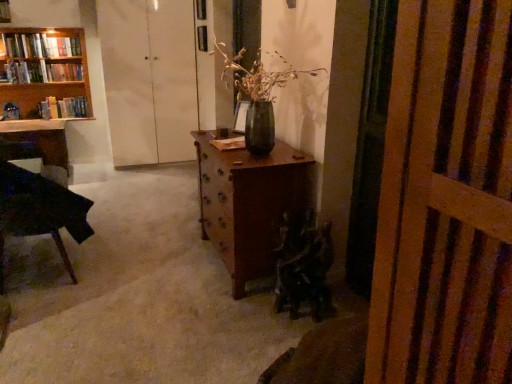
Question: Is matte black desk at left facing away from wooden bookshelf at upper left, arranged as the third book when viewed from the top?

Choices:
 (A) yes
 (B) no

Answer: (B)

Question: Is matte black desk at left not inside wooden bookshelf at upper left, arranged as the third book when viewed from the top?

Choices:
 (A) yes
 (B) no

Answer: (A)

Question: From the image's perspective, is matte black desk at left above wooden bookshelf at upper left, which is the 2th book in bottom-to-top order?

Choices:
 (A) yes
 (B) no

Answer: (B)

Question: From a real-world perspective, is matte black desk at left on top of wooden bookshelf at upper left, which is the 2th book in bottom-to-top order?

Choices:
 (A) no
 (B) yes

Answer: (A)

Question: Is matte black desk at left further to the viewer compared to wooden bookshelf at upper left, arranged as the third book when viewed from the top?

Choices:
 (A) no
 (B) yes

Answer: (A)

Question: Is dark wood chair at left bigger or smaller than dark green fabric armchair at lower center?

Choices:
 (A) big
 (B) small

Answer: (A)

Question: In terms of width, does dark wood chair at left look wider or thinner when compared to dark green fabric armchair at lower center?

Choices:
 (A) thin
 (B) wide

Answer: (B)

Question: Do you think dark wood chair at left is within dark green fabric armchair at lower center, or outside of it?

Choices:
 (A) outside
 (B) inside

Answer: (A)

Question: In terms of height, does dark wood chair at left look taller or shorter compared to dark green fabric armchair at lower center?

Choices:
 (A) tall
 (B) short

Answer: (A)

Question: Do you think wooden bookshelf at left is within hardcover book at left, which appears as the 4th book when viewed from the top, or outside of it?

Choices:
 (A) outside
 (B) inside

Answer: (A)

Question: Considering the positions of wooden bookshelf at left and hardcover book at left, acting as the 1th book starting from the bottom, in the image, is wooden bookshelf at left taller or shorter than hardcover book at left, acting as the 1th book starting from the bottom,?

Choices:
 (A) short
 (B) tall

Answer: (B)

Question: Is point (13, 39) positioned closer to the camera than point (49, 107)?

Choices:
 (A) closer
 (B) farther

Answer: (A)

Question: In the image, is wooden bookshelf at left positioned in front of or behind hardcover book at left, acting as the 1th book starting from the bottom?

Choices:
 (A) behind
 (B) front

Answer: (B)

Question: Is hardcover book at left, which appears as the 4th book when viewed from the top, taller or shorter than wooden bookshelf at upper left, arranged as the third book when viewed from the top?

Choices:
 (A) tall
 (B) short

Answer: (A)

Question: From a real-world perspective, is hardcover book at left, which appears as the 4th book when viewed from the top, physically located above or below wooden bookshelf at upper left, arranged as the third book when viewed from the top?

Choices:
 (A) above
 (B) below

Answer: (B)